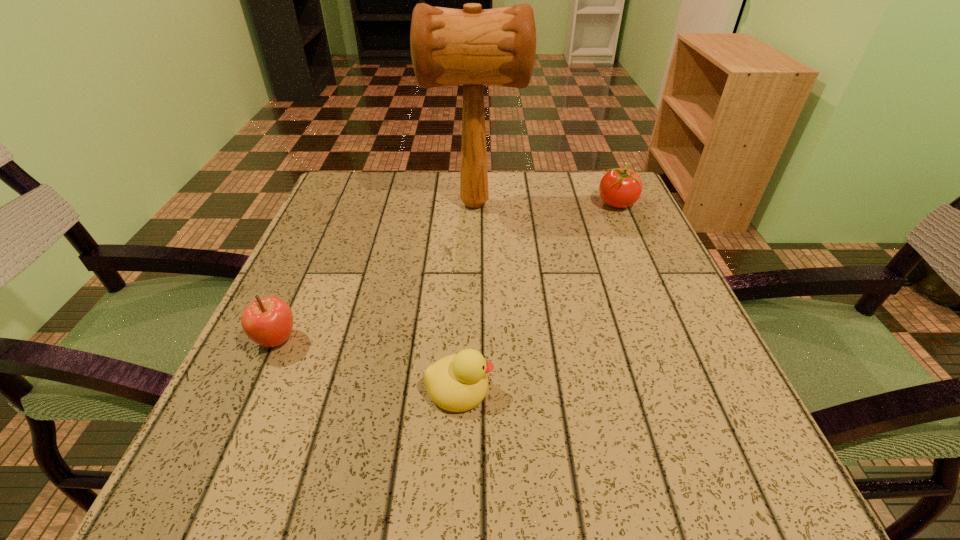
This screenshot has height=540, width=960. I want to click on vacant space at the far right corner of the desktop, so click(x=596, y=213).

Where is `blank space at the near right corner`? blank space at the near right corner is located at coordinates (740, 514).

Locate an element on the screen. vacant area between the leftmost object and the mallet is located at coordinates (375, 272).

You are a GUI agent. You are given a task and a screenshot of the screen. Output one action in this format:
    pyautogui.click(x=<x>, y=<y>)
    Task: Click on the free space that is in between the rightmost object and the nearest object
    The width and height of the screenshot is (960, 540).
    Given the screenshot: What is the action you would take?
    pyautogui.click(x=538, y=295)

Find the location of `free space that is in between the mallet and the apple`. free space that is in between the mallet and the apple is located at coordinates (375, 272).

Locate an element on the screen. free space between the shortest object and the leftmost object is located at coordinates (368, 364).

The height and width of the screenshot is (540, 960). Identify the location of unoccupied position between the leftmost object and the nearest object. (368, 364).

I want to click on vacant area that lies between the tallest object and the duckling, so click(x=468, y=296).

Locate an element on the screen. This screenshot has height=540, width=960. free space between the rightmost object and the tallest object is located at coordinates (545, 204).

I want to click on free space between the tallest object and the tomato, so click(545, 204).